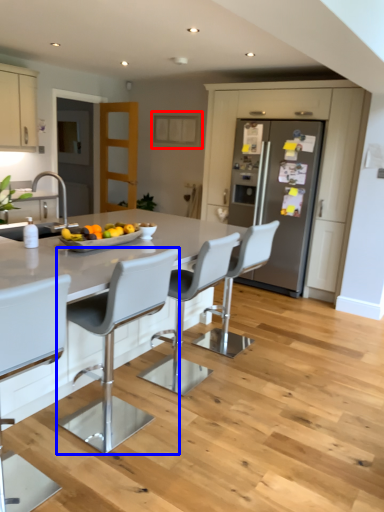
Question: Which object is further to the camera taking this photo, cabinetry (highlighted by a red box) or chair (highlighted by a blue box)?

Choices:
 (A) cabinetry
 (B) chair

Answer: (A)